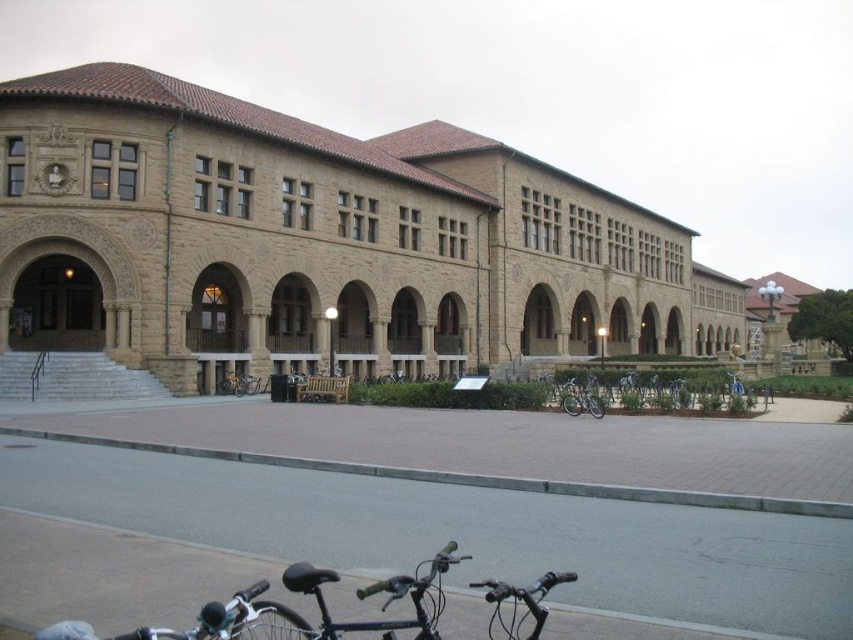
You are standing at the gray concrete curb at lower center and want to take a photo of the historic building. The camera you have requires you to be at least 25 meters away from the subject to capture the entire structure in one frame. Can you achieve this by staying at your current position?

The gray concrete curb at lower center and camera are 25.80 meters apart, so yes, you can capture the entire historic building in one frame by staying at your current position since the distance is more than the required 25 meters.

You are a delivery person trying to park your bike in the plaza in front of the historic building. You see the gray concrete curb at lower center and the shiny metallic bicycle at center. Which object takes up more space in the plaza?

The gray concrete curb at lower center is bigger than the shiny metallic bicycle at center, so it takes up more space in the plaza.